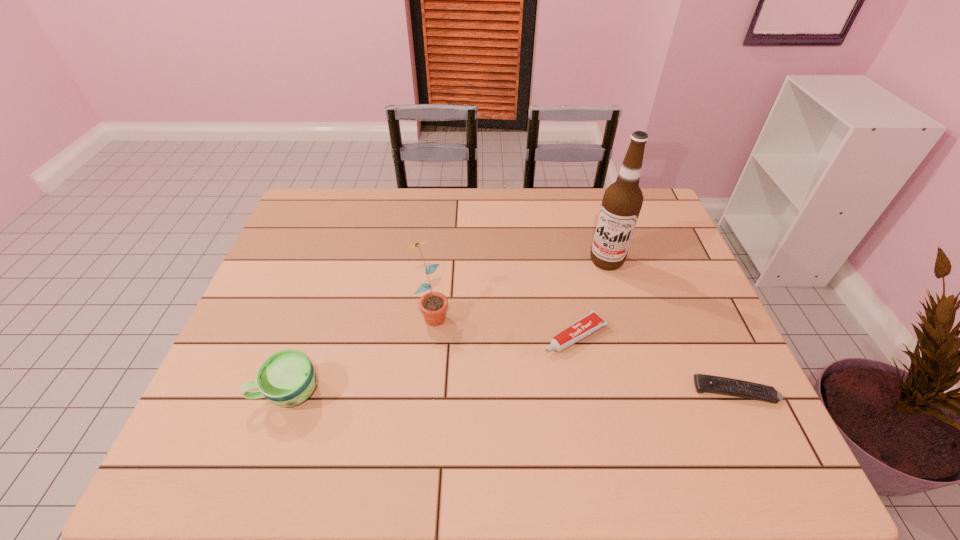
You are a GUI agent. You are given a task and a screenshot of the screen. Output one action in this format:
    pyautogui.click(x=<x>, y=<y>)
    Task: Click on the cup
    This screenshot has width=960, height=540.
    Given the screenshot: What is the action you would take?
    pyautogui.click(x=287, y=378)

Image resolution: width=960 pixels, height=540 pixels. Identify the location of the third shortest object. (287, 378).

Identify the location of the shortest object. The height and width of the screenshot is (540, 960). (704, 383).

The image size is (960, 540). What are the coordinates of `remote control` in the screenshot? It's located at (704, 383).

Identify the location of toothpaste. This screenshot has height=540, width=960. (592, 321).

Image resolution: width=960 pixels, height=540 pixels. In order to click on alcohol in this screenshot , I will do `click(622, 201)`.

Find the location of `the tallest object`. the tallest object is located at coordinates (622, 201).

This screenshot has height=540, width=960. What are the coordinates of `the fourth object from right to left` in the screenshot? It's located at (433, 305).

In order to click on sunflower in this screenshot , I will do `click(433, 305)`.

You are a GUI agent. You are given a task and a screenshot of the screen. Output one action in this format:
    pyautogui.click(x=<x>, y=<y>)
    Task: Click on the blank space located 0.080m on the back of the cup
    
    Given the screenshot: What is the action you would take?
    pyautogui.click(x=305, y=343)